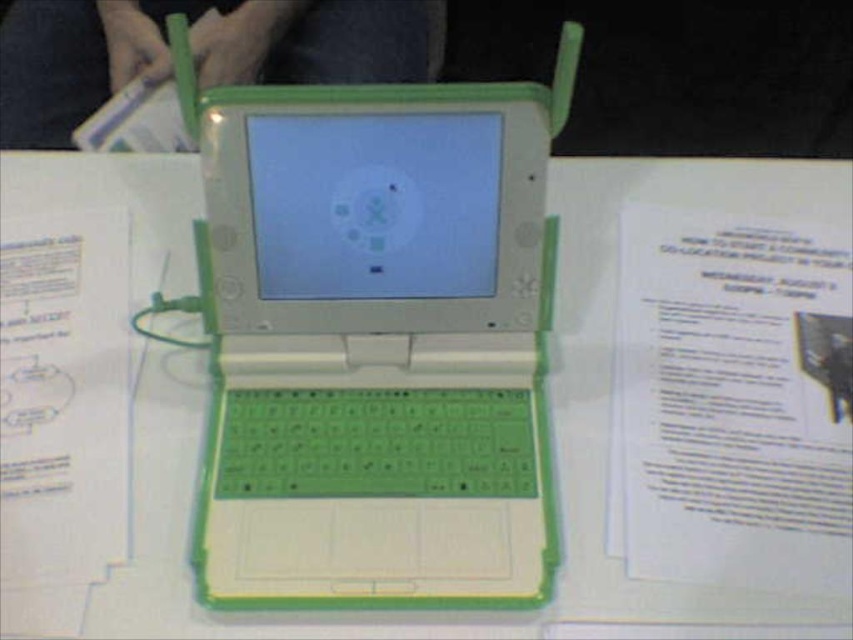
Question: Does green plastic laptop at center appear over white paper at upper right?

Choices:
 (A) no
 (B) yes

Answer: (B)

Question: Considering the relative positions of green plastic laptop at center and white paper at left in the image provided, where is green plastic laptop at center located with respect to white paper at left?

Choices:
 (A) above
 (B) below

Answer: (A)

Question: In this image, where is green plastic laptop at center located relative to white paper at left?

Choices:
 (A) left
 (B) right

Answer: (B)

Question: Which of the following is the closest to the observer?

Choices:
 (A) white paper at left
 (B) green plastic laptop at center

Answer: (B)

Question: Among these objects, which one is farthest from the camera?

Choices:
 (A) white paper at upper right
 (B) green plastic laptop at center

Answer: (A)

Question: Based on their relative distances, which object is farther from the white paper at upper right?

Choices:
 (A) green plastic laptop at center
 (B) white paper at left

Answer: (B)